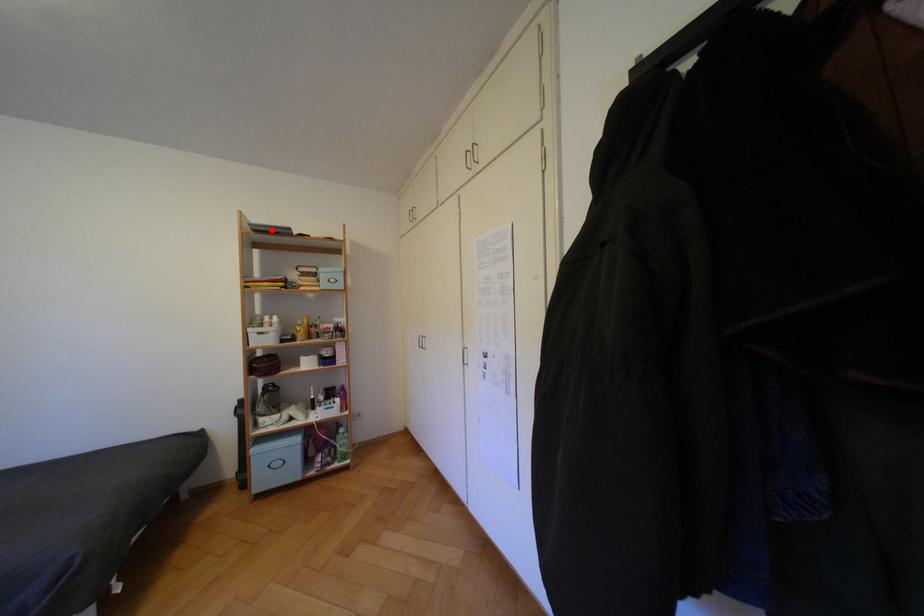
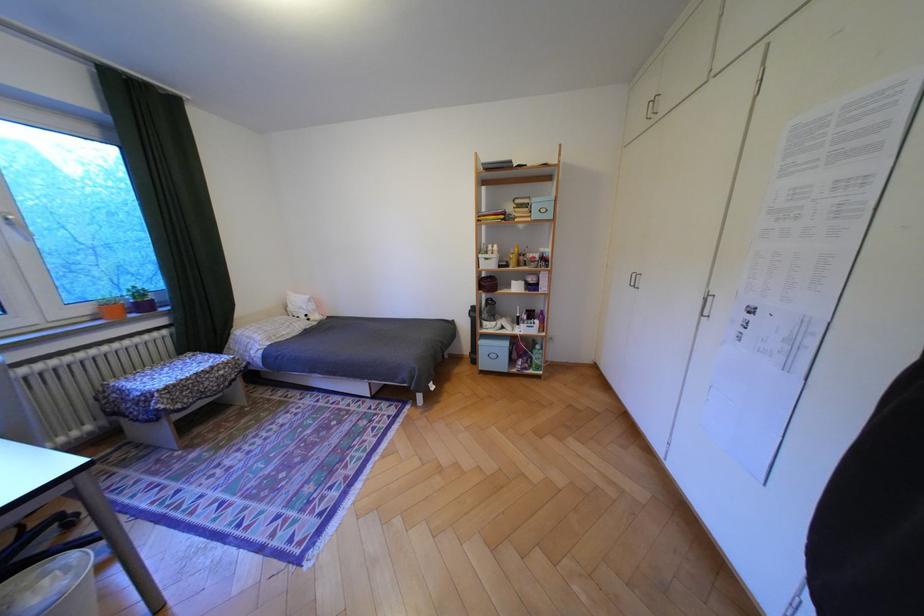
In the second image, find the point that corresponds to the highlighted location in the first image.

(501, 168)